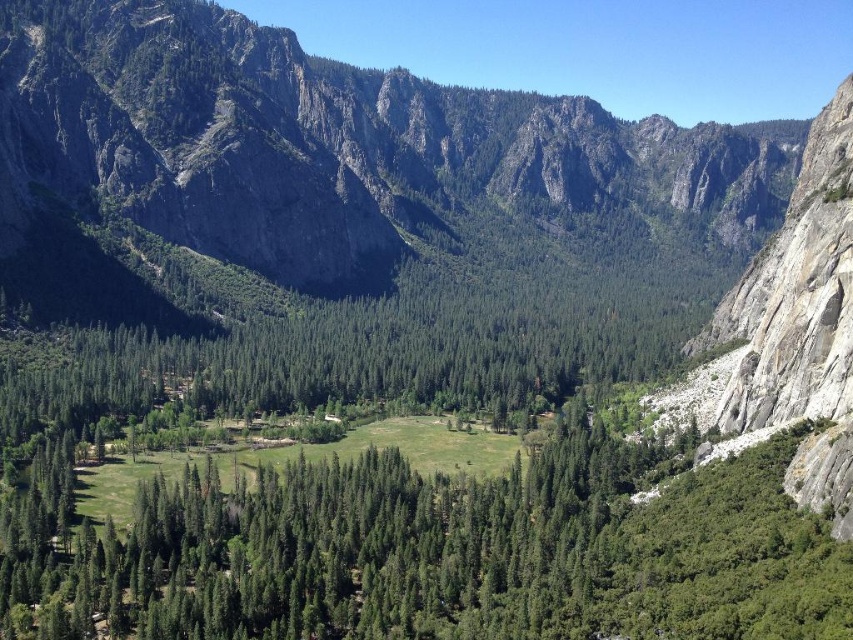
You are a hiker planning to take a photo of the dark gray rocky mountain at center and the green leafy trees at center from the valley floor. Which object will appear larger in your photo?

The dark gray rocky mountain at center will appear larger in the photo because it is much taller than the green leafy trees at center.

You are a hiker planning to cross the meadow in the valley. You notice the dark gray rocky mountain at center and the green leafy trees at center. Which of these two landmarks is located to the right when facing the valley?

The dark gray rocky mountain at center is positioned on the right side of green leafy trees at center, so when facing the valley, the dark gray rocky mountain at center is to the right of the green leafy trees at center.

You are a hiker standing at the point labeled point (219, 36) and want to reach the point labeled point (846, 602). Which direction should you move to get closer to your destination?

You should move forward because point (219, 36) is behind point (846, 602), so moving forward from your current position will bring you closer to the destination.